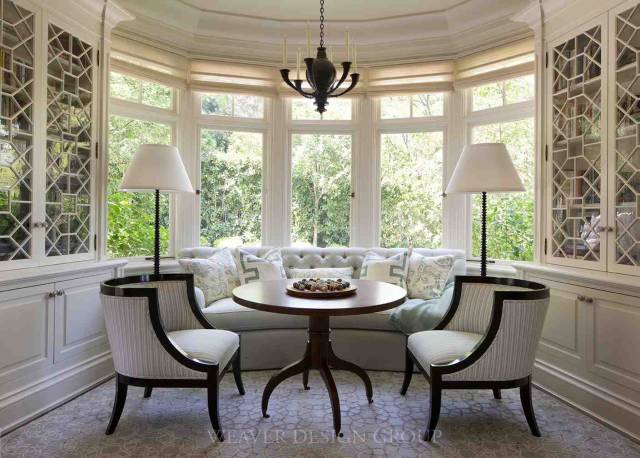
I want to click on chair r, so click(x=512, y=385).